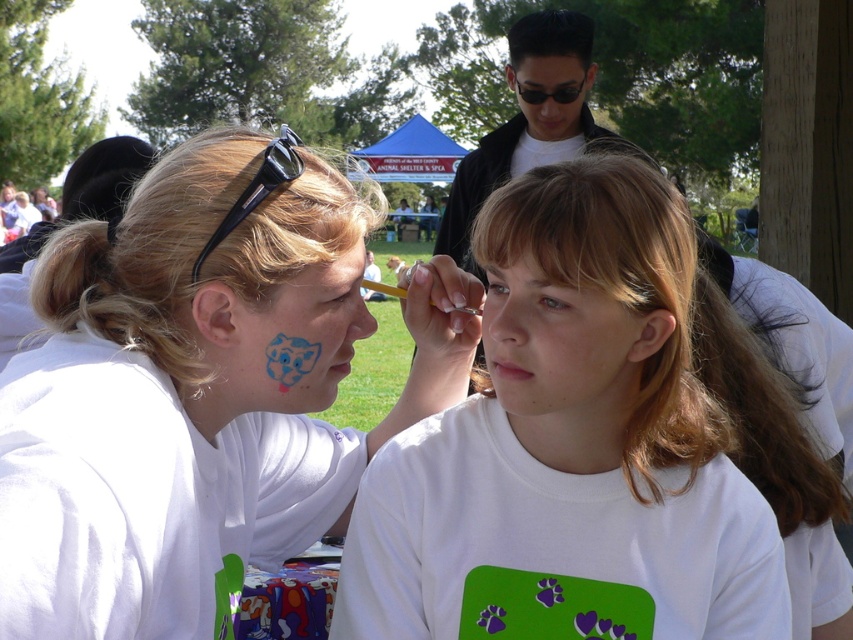
Describe the element at coordinates (570, 448) in the screenshot. I see `white matte shirt at center` at that location.

Measure the distance between white matte shirt at center and camera.

white matte shirt at center is 6.94 feet away from camera.

Where is `white matte shirt at center`? The width and height of the screenshot is (853, 640). white matte shirt at center is located at coordinates (570, 448).

From the picture: Does smooth skin face at center have a greater width compared to black plastic sunglasses at upper left?

No, smooth skin face at center is not wider than black plastic sunglasses at upper left.

Is smooth skin face at center thinner than black plastic sunglasses at upper left?

Yes, smooth skin face at center is thinner than black plastic sunglasses at upper left.

Which is behind, point (553, 316) or point (277, 182)?

Positioned behind is point (553, 316).

Find the location of a particular element. The height and width of the screenshot is (640, 853). smooth skin face at center is located at coordinates (560, 348).

Between matte black face at upper center and matte black forehead at upper center, which one has less height?

With less height is matte black forehead at upper center.

Which is behind, point (532, 132) or point (544, 65)?

The point (532, 132) is behind.

Where is `matte black face at upper center`? matte black face at upper center is located at coordinates [x=550, y=92].